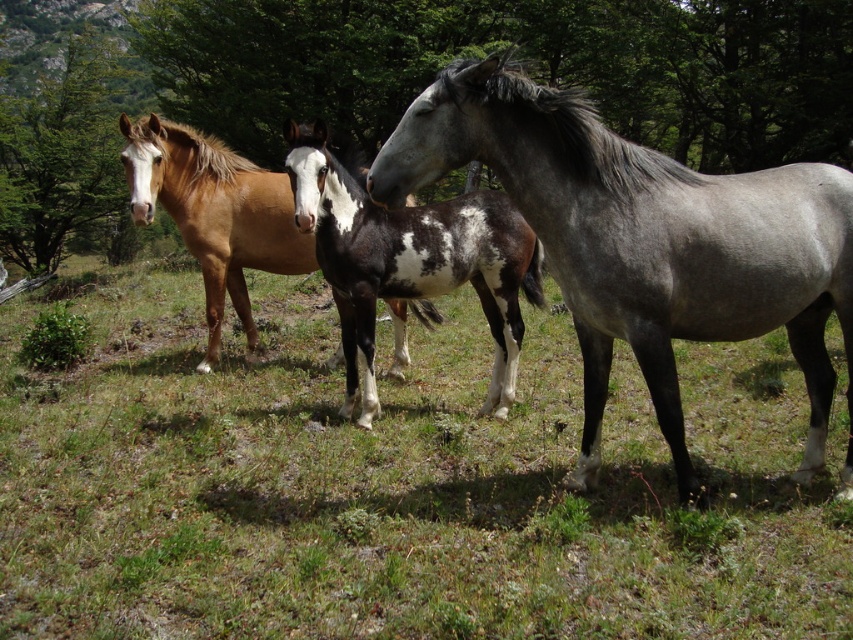
Between spotted glossy horse at center and brown glossy horse at center, which one appears on the left side from the viewer's perspective?

Positioned to the left is brown glossy horse at center.

Which is behind, point (357, 304) or point (151, 124)?

The point (151, 124) is more distant.

Locate an element on the screen. spotted glossy horse at center is located at coordinates (410, 260).

The height and width of the screenshot is (640, 853). Describe the element at coordinates (526, 67) in the screenshot. I see `green leafy tree at upper center` at that location.

The height and width of the screenshot is (640, 853). Describe the element at coordinates (526, 67) in the screenshot. I see `green leafy tree at upper center` at that location.

This screenshot has width=853, height=640. What are the coordinates of `green leafy tree at upper center` in the screenshot? It's located at (526, 67).

Who is positioned more to the right, gray smooth horse at center or spotted glossy horse at center?

Positioned to the right is spotted glossy horse at center.

This screenshot has height=640, width=853. Find the location of `gray smooth horse at center`. gray smooth horse at center is located at coordinates (395, 483).